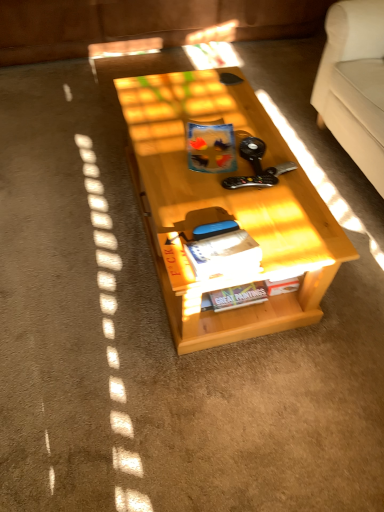
Where is `vacant space that is to the left of matte plastic book at center, placed as the 3th book when sorted from bottom to top`? The image size is (384, 512). vacant space that is to the left of matte plastic book at center, placed as the 3th book when sorted from bottom to top is located at coordinates (165, 160).